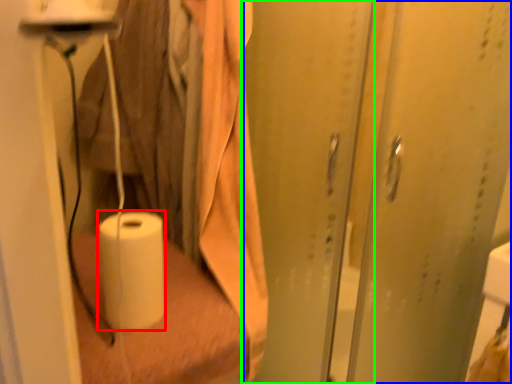
Question: Based on their relative distances, which object is nearer to paper towel (highlighted by a red box)? Choose from screen door (highlighted by a blue box) and screen door (highlighted by a green box).

Choices:
 (A) screen door
 (B) screen door

Answer: (B)